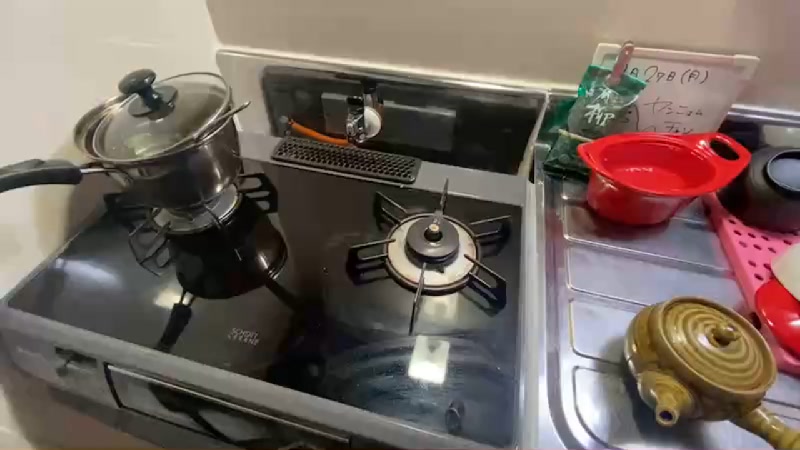
I want to click on small white board standing on counter, so click(690, 102).